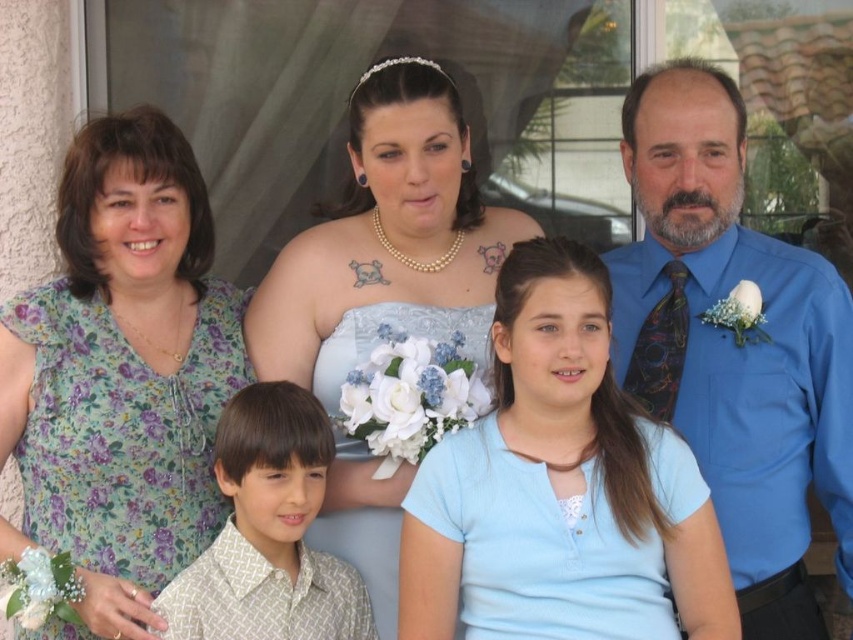
You are standing at the point labeled as point (705, 390) and want to walk to the point labeled as point (199, 376). Which direction should you move in to reach your destination?

You should move towards the direction opposite of where point (705, 390) is located, since point (199, 376) is behind point (705, 390) from your current position.